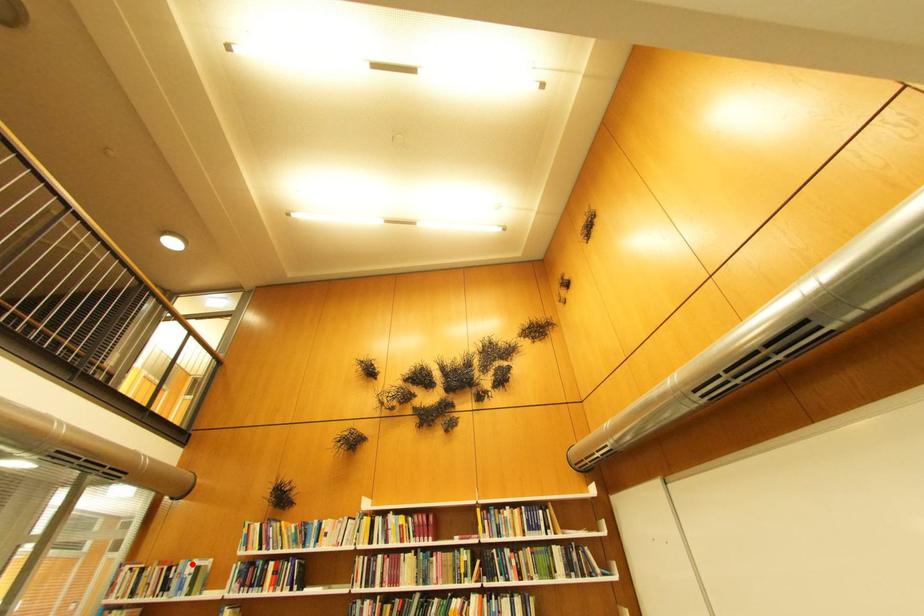
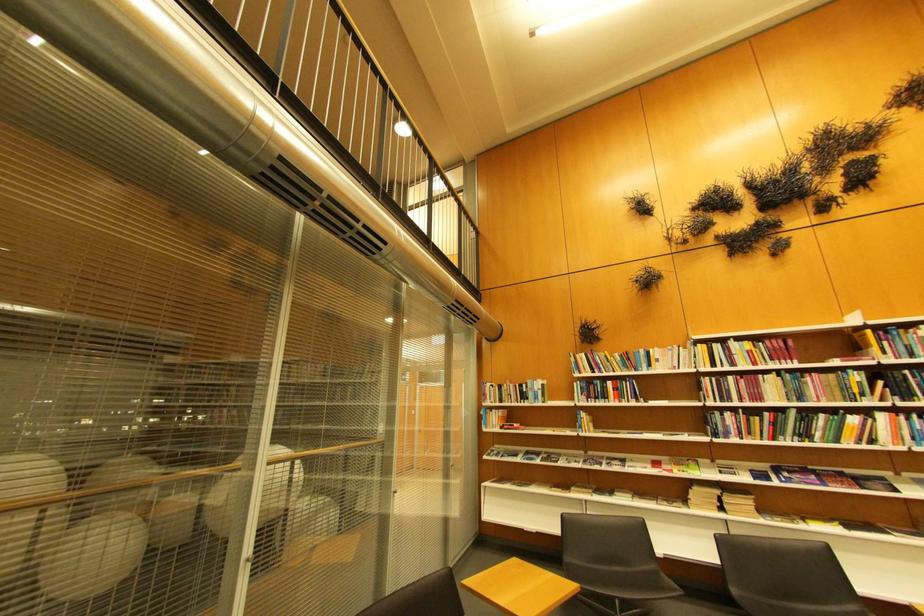
In the second image, find the point that corresponds to the highlighted location in the first image.

(540, 383)